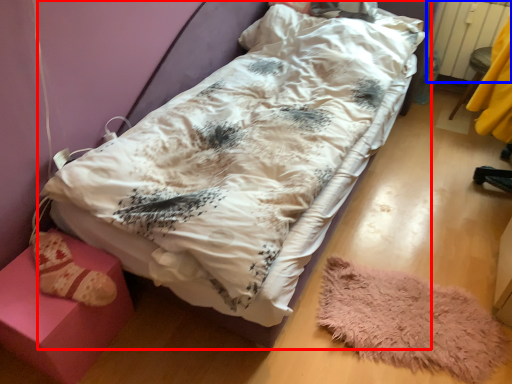
Question: Which point is closer to the camera, hospital bed (highlighted by a red box) or radiator (highlighted by a blue box)?

Choices:
 (A) hospital bed
 (B) radiator

Answer: (A)